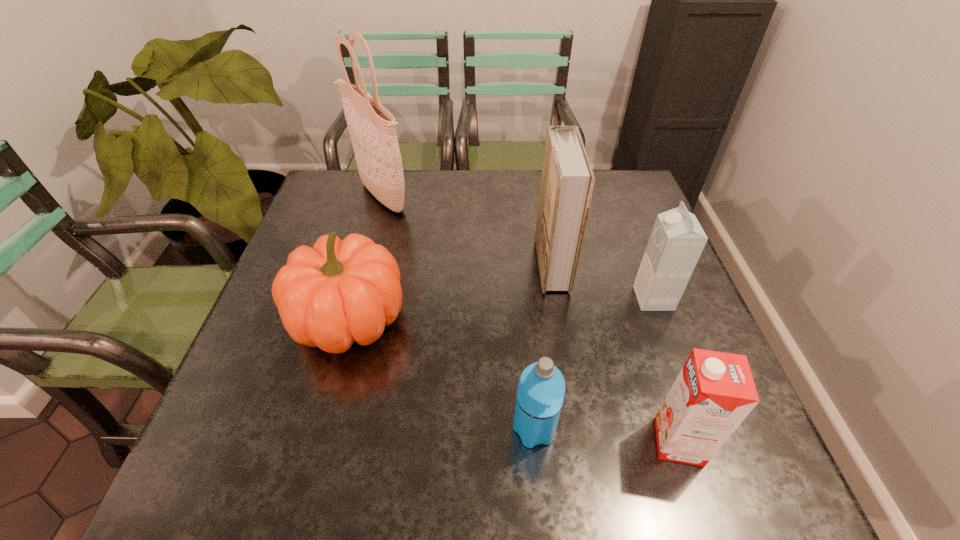
The image size is (960, 540). Find the location of `thermos bottle that is at the near edge`. thermos bottle that is at the near edge is located at coordinates (541, 388).

This screenshot has height=540, width=960. Identify the location of shopping bag present at the left edge. (371, 126).

The width and height of the screenshot is (960, 540). What are the coordinates of `pumpkin present at the left edge` in the screenshot? It's located at (340, 291).

Locate an element on the screen. The height and width of the screenshot is (540, 960). object located in the far left corner section of the desktop is located at coordinates (371, 126).

Locate an element on the screen. The image size is (960, 540). object situated at the near right corner is located at coordinates (714, 392).

In order to click on vacant space at the far edge in this screenshot , I will do `click(426, 181)`.

You are a GUI agent. You are given a task and a screenshot of the screen. Output one action in this format:
    pyautogui.click(x=<x>, y=<y>)
    Task: Click on the free space at the near edge of the desktop
    
    Given the screenshot: What is the action you would take?
    pyautogui.click(x=569, y=455)

Image resolution: width=960 pixels, height=540 pixels. Identify the location of vacant space at the right edge of the desktop. (636, 253).

In the image, there is a desktop. Where is `vacant region at the far left corner`? vacant region at the far left corner is located at coordinates (352, 173).

In the image, there is a desktop. In order to click on vacant space at the near left corner in this screenshot , I will do `click(251, 484)`.